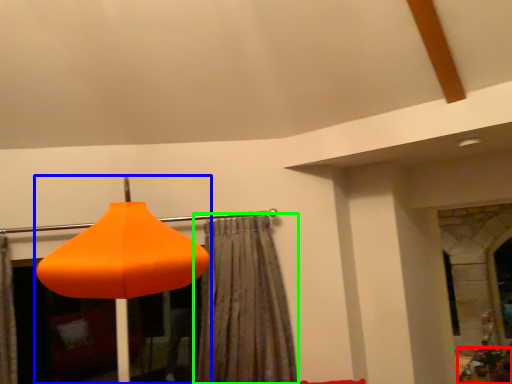
Question: Considering the real-world distances, which object is farthest from furniture (highlighted by a red box)? lamp (highlighted by a blue box) or curtain (highlighted by a green box)?

Choices:
 (A) lamp
 (B) curtain

Answer: (A)